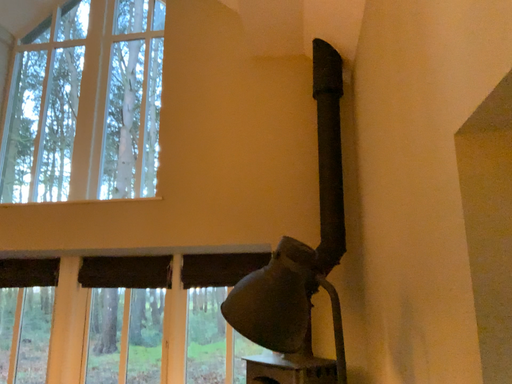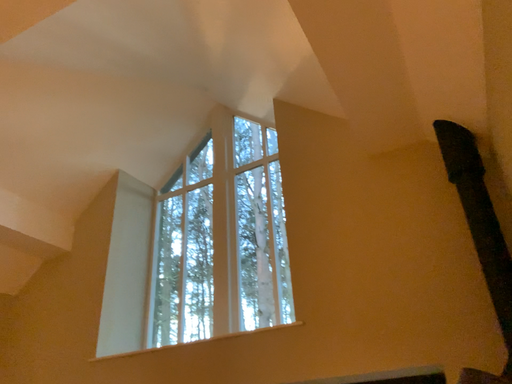
Question: How did the camera likely rotate when shooting the video?

Choices:
 (A) rotated left
 (B) rotated right

Answer: (A)